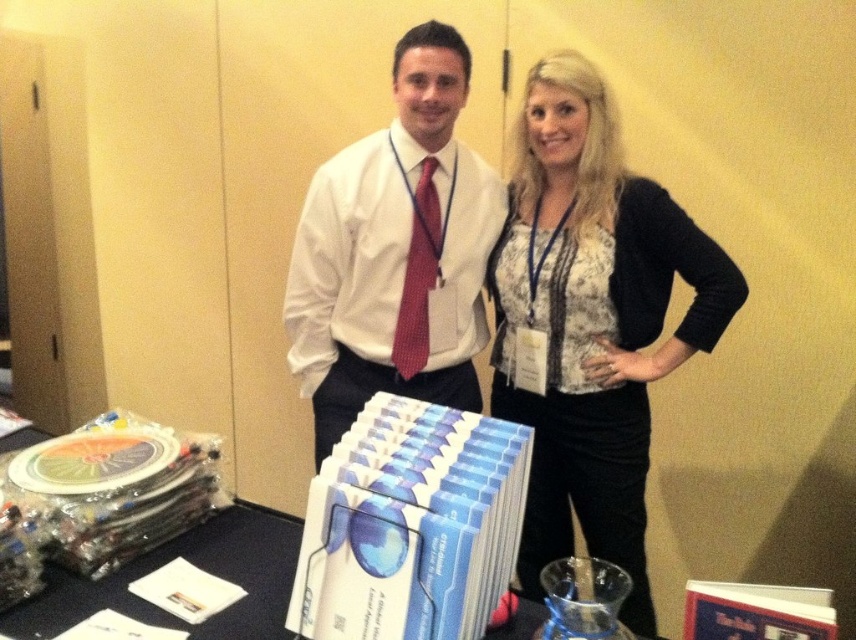
Question: Which of the following is the farthest from the observer?

Choices:
 (A) (657, 310)
 (B) (494, 200)

Answer: (B)

Question: Does white lace blouse at center have a lesser width compared to white shirt at center?

Choices:
 (A) no
 (B) yes

Answer: (B)

Question: Considering the relative positions of white lace blouse at center and white shirt at center in the image provided, where is white lace blouse at center located with respect to white shirt at center?

Choices:
 (A) right
 (B) left

Answer: (A)

Question: Can you confirm if white lace blouse at center is positioned to the right of white shirt at center?

Choices:
 (A) no
 (B) yes

Answer: (B)

Question: Which point appears closest to the camera in this image?

Choices:
 (A) (354, 336)
 (B) (642, 524)

Answer: (B)